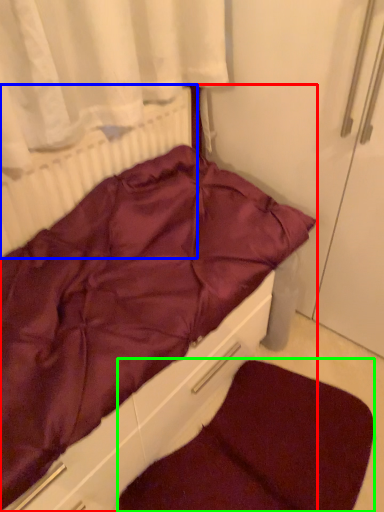
Question: Estimate the real-world distances between objects in this image. Which object is closer to furniture (highlighted by a red box), radiator (highlighted by a blue box) or dog bed (highlighted by a green box)?

Choices:
 (A) radiator
 (B) dog bed

Answer: (A)